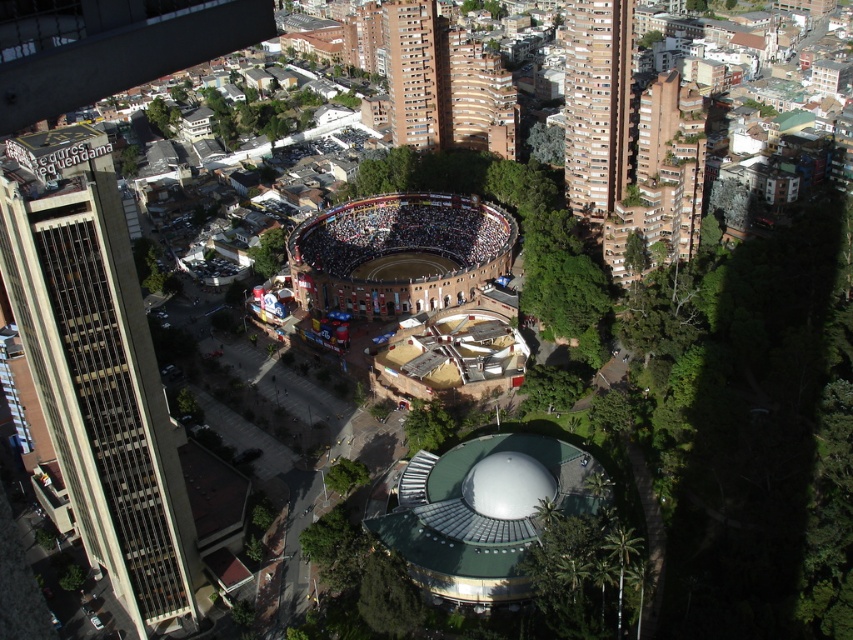
Question: Based on their relative distances, which object is nearer to the beige concrete tower at left?

Choices:
 (A) brown brick building at upper right
 (B) brown brick arena at center

Answer: (B)

Question: Is beige concrete tower at left positioned at the back of brown brick building at upper right?

Choices:
 (A) yes
 (B) no

Answer: (B)

Question: Can you confirm if brown brick building at upper right is wider than brown brick arena at center?

Choices:
 (A) yes
 (B) no

Answer: (B)

Question: Can you confirm if beige concrete tower at left is positioned above brown brick arena at center?

Choices:
 (A) yes
 (B) no

Answer: (B)

Question: Which point is farther to the camera?

Choices:
 (A) brown brick arena at center
 (B) beige concrete tower at left

Answer: (A)

Question: Which of the following is the farthest from the observer?

Choices:
 (A) (613, 115)
 (B) (32, 291)
 (C) (438, 200)

Answer: (C)